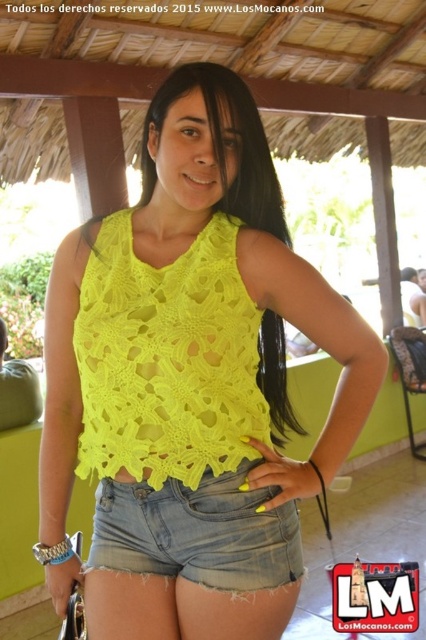
Question: Where is neon yellow crochet tank top at center located in relation to denim shorts at lower center in the image?

Choices:
 (A) right
 (B) left

Answer: (B)

Question: Which point is closer to the camera?

Choices:
 (A) neon yellow crochet tank top at center
 (B) denim shorts at lower center

Answer: (A)

Question: Where is neon yellow crochet tank top at center located in relation to denim shorts at lower center in the image?

Choices:
 (A) below
 (B) above

Answer: (B)

Question: Is the position of neon yellow crochet tank top at center less distant than that of denim shorts at lower center?

Choices:
 (A) yes
 (B) no

Answer: (A)

Question: Among these points, which one is nearest to the camera?

Choices:
 (A) (115, 554)
 (B) (253, 353)

Answer: (A)

Question: Which object appears farthest from the camera in this image?

Choices:
 (A) neon yellow crochet tank top at center
 (B) denim shorts at lower center

Answer: (B)